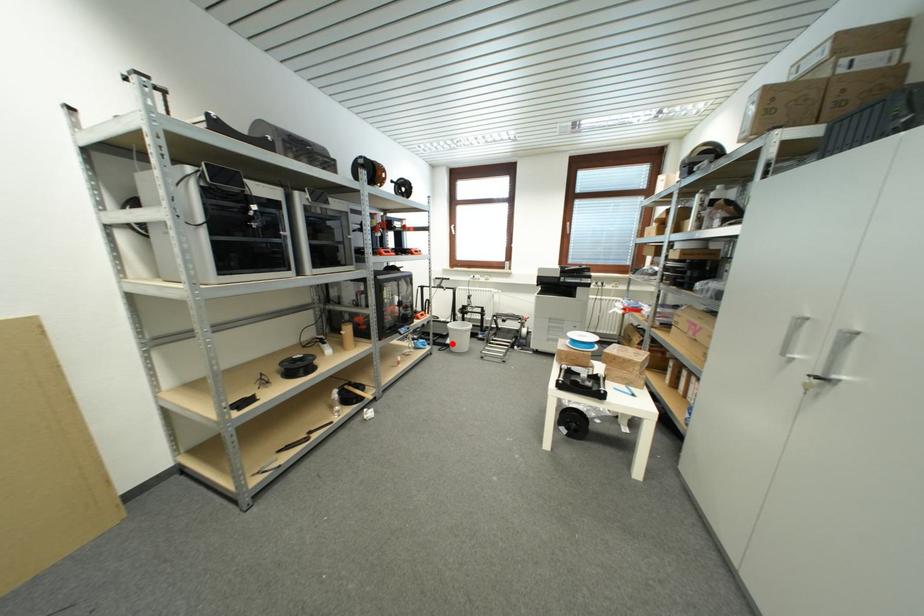
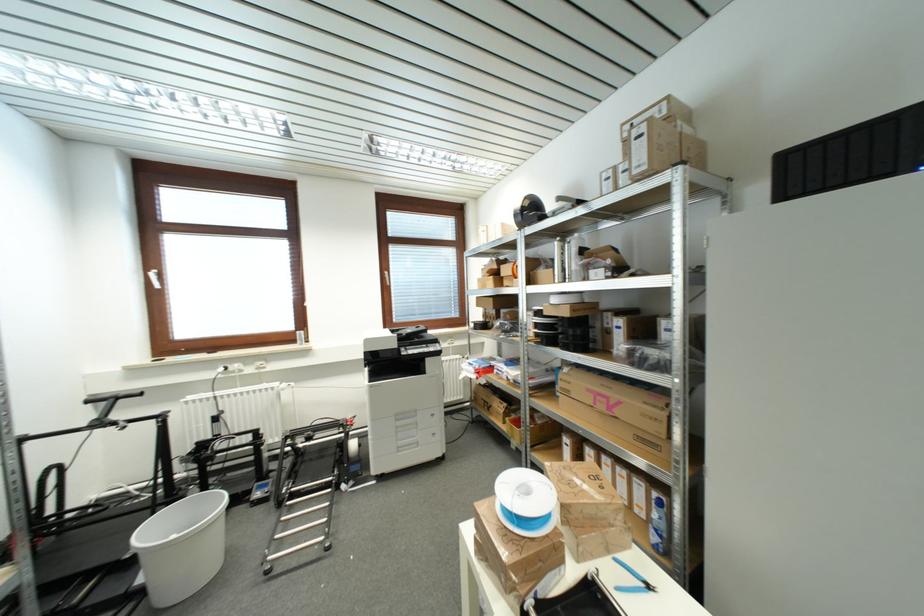
Question: I am providing you with two images of the same scene from different viewpoints. A red point is shown in image1. For the corresponding object point in image2, is it positioned nearer or farther from the camera?

Choices:
 (A) Nearer
 (B) Farther

Answer: (A)